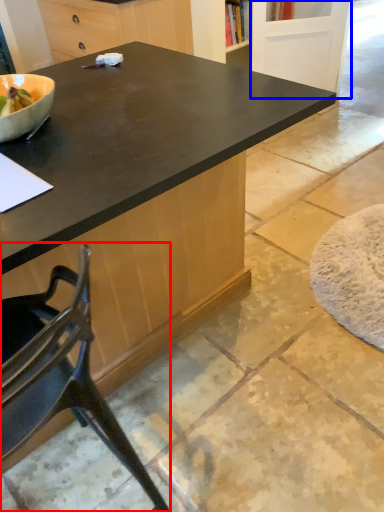
Question: Among these objects, which one is farthest to the camera, chair (highlighted by a red box) or screen door (highlighted by a blue box)?

Choices:
 (A) chair
 (B) screen door

Answer: (B)